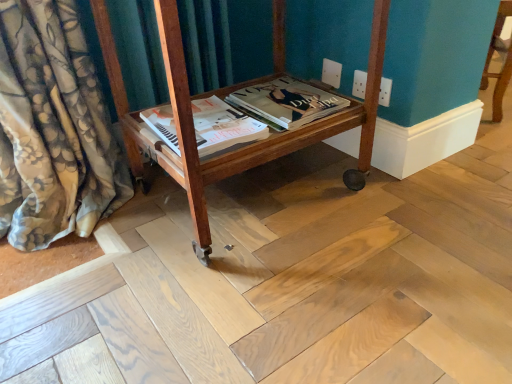
Question: Is matte paper magazine at center, which appears as the 1th magazine when viewed from the right, to the right of wooden cart at center from the viewer's perspective?

Choices:
 (A) no
 (B) yes

Answer: (B)

Question: Can you confirm if matte paper magazine at center, the second magazine in the left-to-right sequence, is wider than wooden cart at center?

Choices:
 (A) yes
 (B) no

Answer: (B)

Question: Is matte paper magazine at center, the second magazine in the left-to-right sequence, facing towards wooden cart at center?

Choices:
 (A) yes
 (B) no

Answer: (A)

Question: Is matte paper magazine at center, the second magazine in the left-to-right sequence, turned away from wooden cart at center?

Choices:
 (A) yes
 (B) no

Answer: (A)

Question: Is wooden cart at center located within matte paper magazine at center, the second magazine in the left-to-right sequence?

Choices:
 (A) yes
 (B) no

Answer: (B)

Question: From the image's perspective, relative to wooden cart at center, is matte paper magazine at center, which appears as the 1th magazine when viewed from the right, above or below?

Choices:
 (A) below
 (B) above

Answer: (B)

Question: Is matte paper magazine at center, the second magazine in the left-to-right sequence, inside or outside of wooden cart at center?

Choices:
 (A) inside
 (B) outside

Answer: (A)

Question: In the image, is matte paper magazine at center, the second magazine in the left-to-right sequence, positioned in front of or behind wooden cart at center?

Choices:
 (A) behind
 (B) front

Answer: (A)

Question: In terms of size, does matte paper magazine at center, which appears as the 1th magazine when viewed from the right, appear bigger or smaller than wooden cart at center?

Choices:
 (A) big
 (B) small

Answer: (B)

Question: In the image, is matte paper magazine at center, the second magazine in the left-to-right sequence, positioned in front of or behind matte paper magazine at center, the 2th magazine positioned from the right?

Choices:
 (A) behind
 (B) front

Answer: (A)

Question: Is point (285, 124) positioned closer to the camera than point (242, 114)?

Choices:
 (A) farther
 (B) closer

Answer: (B)

Question: From a real-world perspective, relative to matte paper magazine at center, the 2th magazine positioned from the right, is matte paper magazine at center, the second magazine in the left-to-right sequence, vertically above or below?

Choices:
 (A) above
 (B) below

Answer: (B)

Question: Looking at their shapes, would you say matte paper magazine at center, the second magazine in the left-to-right sequence, is wider or thinner than matte paper magazine at center, which is the 1th magazine from left to right?

Choices:
 (A) thin
 (B) wide

Answer: (A)

Question: From their relative heights in the image, would you say matte paper magazine at center, the 2th magazine positioned from the right, is taller or shorter than matte paper magazine at center, the second magazine in the left-to-right sequence?

Choices:
 (A) short
 (B) tall

Answer: (A)

Question: Is matte paper magazine at center, the 2th magazine positioned from the right, inside or outside of matte paper magazine at center, the second magazine in the left-to-right sequence?

Choices:
 (A) outside
 (B) inside

Answer: (A)